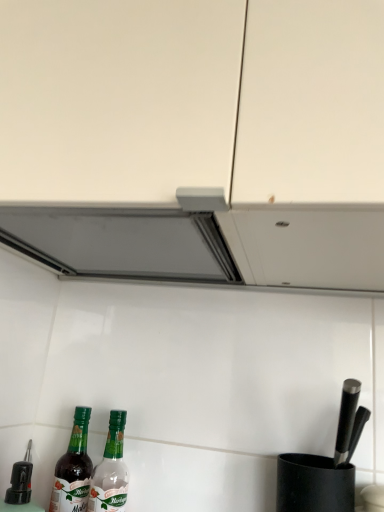
Question: From the image's perspective, is green glass bottle at lower left, which is the first bottle in right-to-left order, on top of green glass bottle at lower left, the 2th bottle from the right?

Choices:
 (A) no
 (B) yes

Answer: (A)

Question: Would you say green glass bottle at lower left, which is the first bottle in right-to-left order, is outside green glass bottle at lower left, the 2th bottle from the right?

Choices:
 (A) no
 (B) yes

Answer: (B)

Question: Considering the relative sizes of green glass bottle at lower left, which appears as the second bottle when viewed from the left, and green glass bottle at lower left, marked as the first bottle in a left-to-right arrangement, in the image provided, is green glass bottle at lower left, which appears as the second bottle when viewed from the left, smaller than green glass bottle at lower left, marked as the first bottle in a left-to-right arrangement,?

Choices:
 (A) yes
 (B) no

Answer: (B)

Question: Can you confirm if green glass bottle at lower left, which is the first bottle in right-to-left order, is positioned to the left of green glass bottle at lower left, the 2th bottle from the right?

Choices:
 (A) no
 (B) yes

Answer: (A)

Question: Is green glass bottle at lower left, which is the first bottle in right-to-left order, further to camera compared to green glass bottle at lower left, the 2th bottle from the right?

Choices:
 (A) no
 (B) yes

Answer: (A)

Question: Is green glass bottle at lower left, which appears as the second bottle when viewed from the left, next to green glass bottle at lower left, the 2th bottle from the right?

Choices:
 (A) yes
 (B) no

Answer: (A)

Question: From the image's perspective, would you say green glass bottle at lower left, the 2th bottle from the right, is shown under green glass bottle at lower left, which is the first bottle in right-to-left order?

Choices:
 (A) yes
 (B) no

Answer: (B)

Question: Is green glass bottle at lower left, marked as the first bottle in a left-to-right arrangement, oriented towards green glass bottle at lower left, which appears as the second bottle when viewed from the left?

Choices:
 (A) no
 (B) yes

Answer: (A)

Question: Is green glass bottle at lower left, which appears as the second bottle when viewed from the left, inside green glass bottle at lower left, the 2th bottle from the right?

Choices:
 (A) no
 (B) yes

Answer: (A)

Question: Is green glass bottle at lower left, marked as the first bottle in a left-to-right arrangement, taller than green glass bottle at lower left, which is the first bottle in right-to-left order?

Choices:
 (A) no
 (B) yes

Answer: (A)

Question: Does green glass bottle at lower left, the 2th bottle from the right, have a lesser width compared to green glass bottle at lower left, which appears as the second bottle when viewed from the left?

Choices:
 (A) yes
 (B) no

Answer: (B)

Question: Considering the relative sizes of green glass bottle at lower left, the 2th bottle from the right, and green glass bottle at lower left, which appears as the second bottle when viewed from the left, in the image provided, is green glass bottle at lower left, the 2th bottle from the right, bigger than green glass bottle at lower left, which appears as the second bottle when viewed from the left,?

Choices:
 (A) no
 (B) yes

Answer: (A)

Question: Looking at their shapes, would you say green glass bottle at lower left, the 2th bottle from the right, is wider or thinner than green glass bottle at lower left, which is the first bottle in right-to-left order?

Choices:
 (A) wide
 (B) thin

Answer: (A)